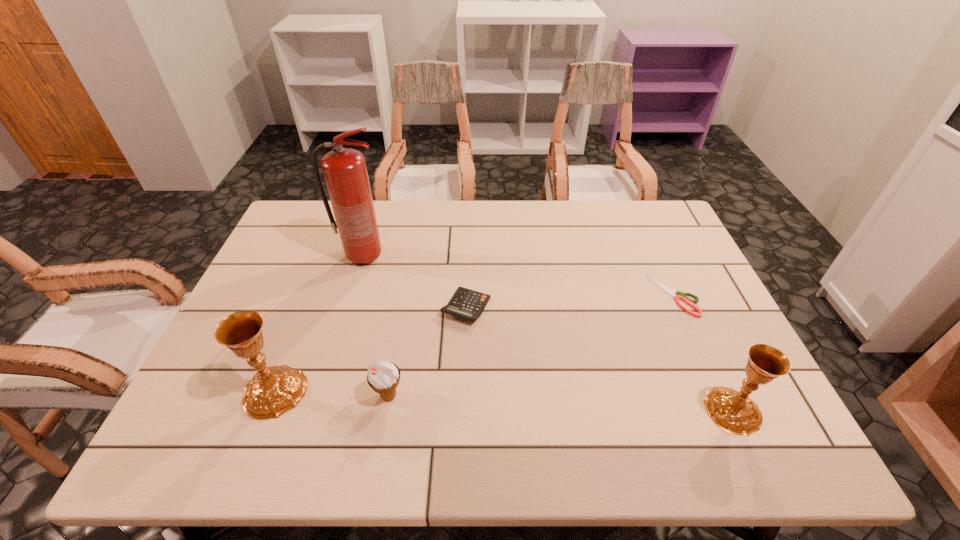
Identify the location of the taller chalice. Image resolution: width=960 pixels, height=540 pixels. (274, 390).

Find the location of `the left chalice`. the left chalice is located at coordinates (274, 390).

The width and height of the screenshot is (960, 540). Find the location of `the third tallest object`. the third tallest object is located at coordinates (733, 411).

Locate an element on the screen. This screenshot has width=960, height=540. the shorter chalice is located at coordinates (733, 411).

Find the location of a particular element. This screenshot has height=540, width=960. the fifth tallest object is located at coordinates (468, 304).

Locate an element on the screen. This screenshot has height=540, width=960. the third object from right to left is located at coordinates (468, 304).

Identify the location of fire extinguisher. (345, 172).

Where is `the farthest object`? This screenshot has width=960, height=540. the farthest object is located at coordinates (345, 172).

Find the location of `the shortest object`. the shortest object is located at coordinates (680, 295).

Locate an element on the screen. This screenshot has height=540, width=960. the third object from left to right is located at coordinates (383, 377).